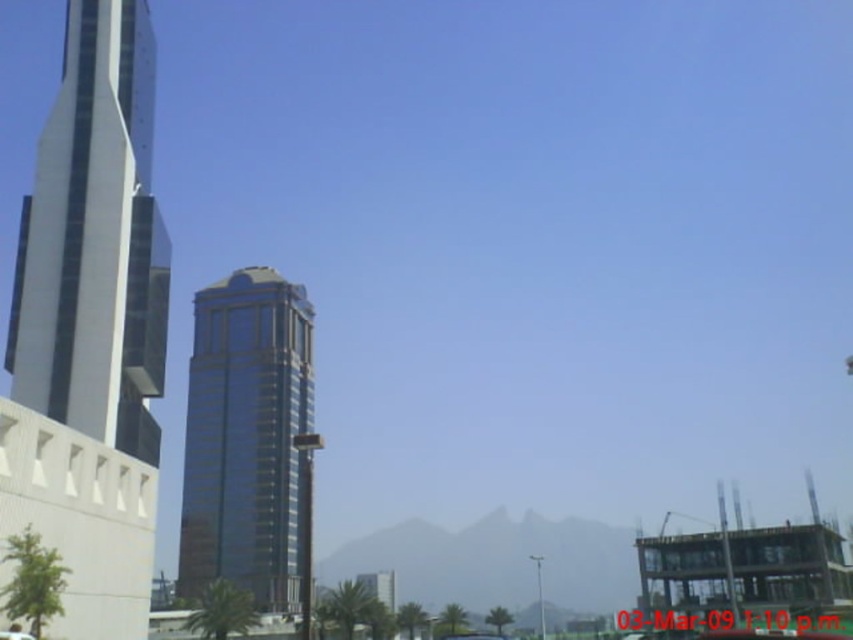
Between glassy metallic skyscraper at left and glossy glass tower at center, which one has less height?

With less height is glassy metallic skyscraper at left.

Is glassy metallic skyscraper at left above glossy glass tower at center?

Indeed, glassy metallic skyscraper at left is positioned over glossy glass tower at center.

Does point (112, 433) lie behind point (207, 544)?

No.

The width and height of the screenshot is (853, 640). I want to click on glassy metallic skyscraper at left, so click(x=96, y=241).

Who is more forward, (16, 381) or (10, 634)?

Point (10, 634) is more forward.

Between point (93, 326) and point (18, 634), which one is positioned in front?

Point (18, 634)

The width and height of the screenshot is (853, 640). What are the coordinates of `glassy metallic skyscraper at left` in the screenshot? It's located at (96, 241).

Does glossy glass tower at center have a lesser width compared to metallic silver car at lower left?

No.

The width and height of the screenshot is (853, 640). What do you see at coordinates (247, 436) in the screenshot?
I see `glossy glass tower at center` at bounding box center [247, 436].

Where is `glossy glass tower at center`? Image resolution: width=853 pixels, height=640 pixels. glossy glass tower at center is located at coordinates (247, 436).